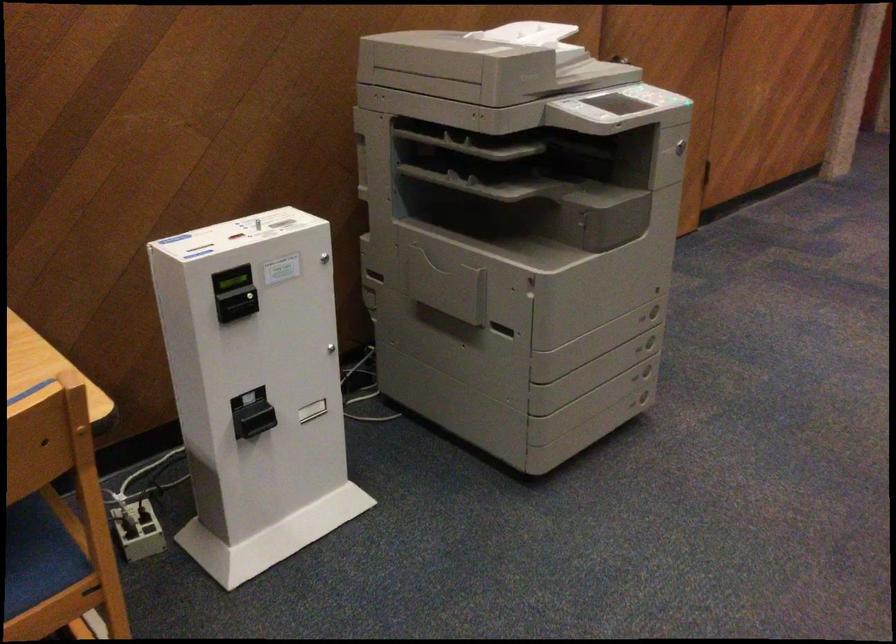
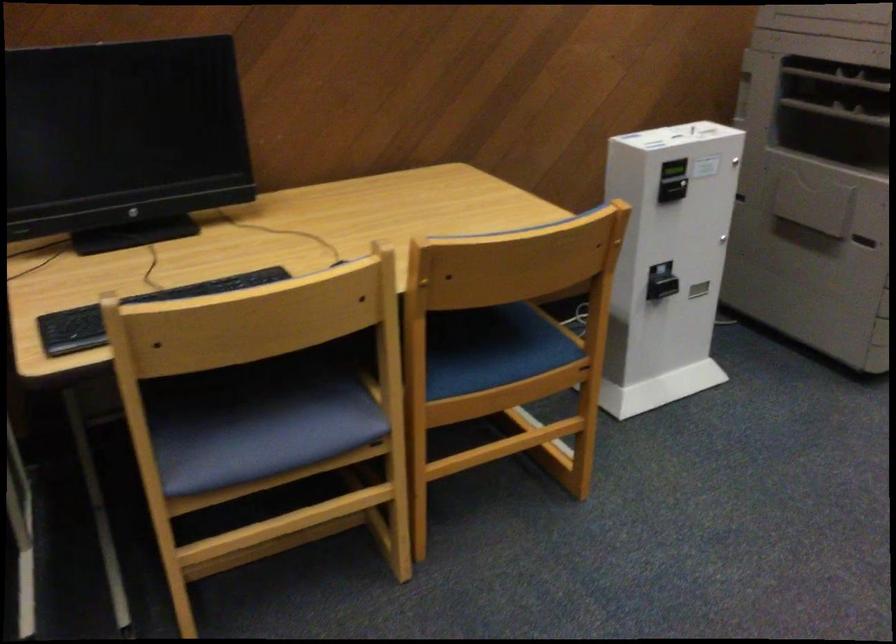
Where in the second image is the point corresponding to (x=448, y=190) from the first image?

(836, 111)